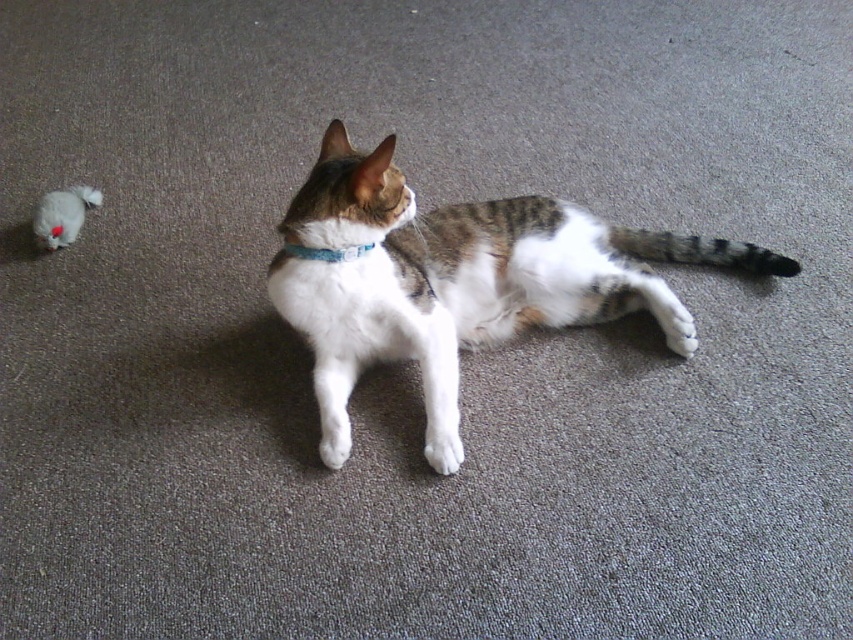
Question: Which object is closer to the camera taking this photo?

Choices:
 (A) white fur paw at lower center
 (B) white plush toy at left
 (C) blue fabric neckband at center
 (D) white fur cat at center

Answer: (D)

Question: Is white plush toy at left below white fur at lower center?

Choices:
 (A) yes
 (B) no

Answer: (B)

Question: Among these objects, which one is farthest from the camera?

Choices:
 (A) white fur paw at lower center
 (B) white fur at lower center
 (C) white fur cat at center
 (D) white plush toy at left

Answer: (D)

Question: Is white fur cat at center closer to camera compared to blue fabric neckband at center?

Choices:
 (A) yes
 (B) no

Answer: (A)

Question: Which of the following is the closest to the observer?

Choices:
 (A) (440, 472)
 (B) (343, 426)
 (C) (79, 188)
 (D) (299, 252)

Answer: (A)

Question: Where is white fur cat at center located in relation to white fur paw at lower center in the image?

Choices:
 (A) below
 (B) above

Answer: (B)